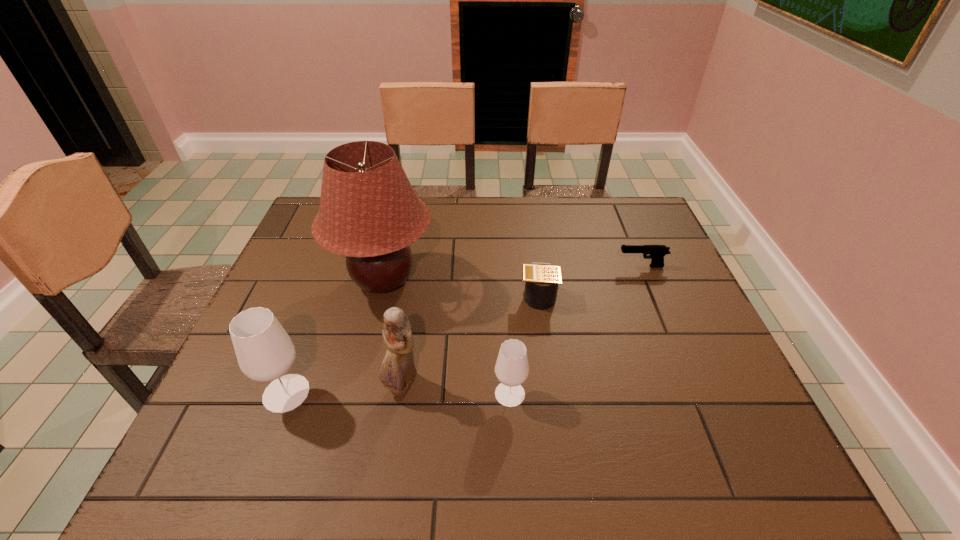
Find the location of `free space between the shorter glass and the lampshade`. free space between the shorter glass and the lampshade is located at coordinates (446, 337).

Locate an element on the screen. unoccupied area between the second object from right to left and the pistol is located at coordinates (590, 281).

Where is `vacant area that lies between the rightmost object and the calculator`? The width and height of the screenshot is (960, 540). vacant area that lies between the rightmost object and the calculator is located at coordinates pyautogui.click(x=590, y=281).

The width and height of the screenshot is (960, 540). In order to click on empty space that is in between the rightmost object and the third object from right to left in this screenshot , I will do `click(576, 330)`.

What are the coordinates of `the fifth closest object to the fifth object from left to right` in the screenshot? It's located at (265, 352).

Locate which object ranks fifth in proximity to the shortest object. Please provide its 2D coordinates. Your answer should be formatted as a tuple, i.e. [(x, y)], where the tuple contains the x and y coordinates of a point satisfying the conditions above.

[(265, 352)]

The height and width of the screenshot is (540, 960). In order to click on free space that satisfies the following two spatial constraints: 1. on the front-facing side of the pistol; 2. on the front-facing side of the figurine in this screenshot , I will do (x=691, y=386).

Find the location of `free space that satisfies the following two spatial constraints: 1. on the front-facing side of the lampshade; 2. on the back side of the calculator`. free space that satisfies the following two spatial constraints: 1. on the front-facing side of the lampshade; 2. on the back side of the calculator is located at coordinates (380, 295).

Identify the location of free location that satisfies the following two spatial constraints: 1. on the front-facing side of the lampshade; 2. on the left side of the shorter glass. pyautogui.click(x=356, y=394).

Locate an element on the screen. This screenshot has height=540, width=960. vacant space that satisfies the following two spatial constraints: 1. on the front-facing side of the rightmost object; 2. on the front side of the calculator is located at coordinates (653, 295).